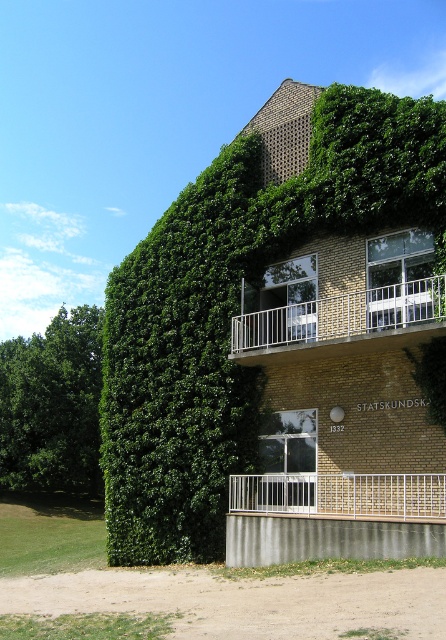
You are standing in front of the building and want to take a photo of the white metal balcony at center without including the green leafy tree at left. Which direction should you move to achieve this?

Move to the right side of the white metal balcony at center so that the green leafy tree at left is no longer in the frame.

You are standing in front of the building and want to determine the position of two points marked on the ivy. Which point is closer to you, point 1 at coordinates point (337, 308) or point 2 at coordinates point (388, 508)?

Point (337, 308) is further to the camera than point (388, 508), so point 2 at coordinates point (388, 508) is closer to you.